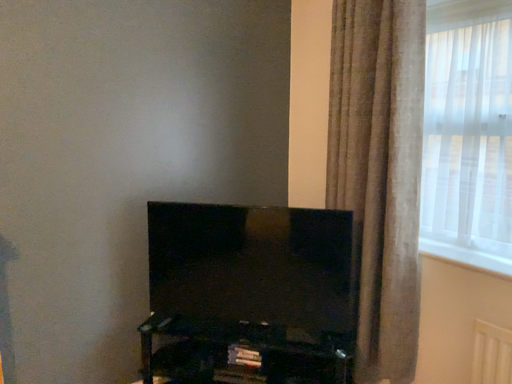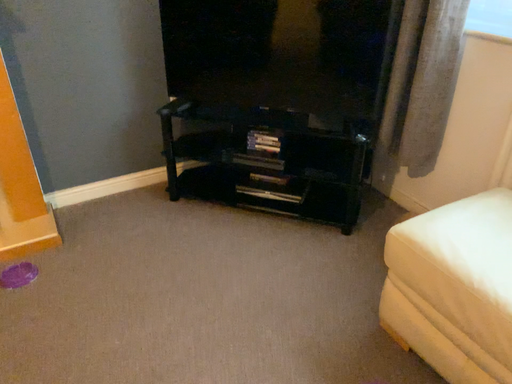
Question: Which way did the camera rotate in the video?

Choices:
 (A) rotated upward
 (B) rotated downward

Answer: (B)